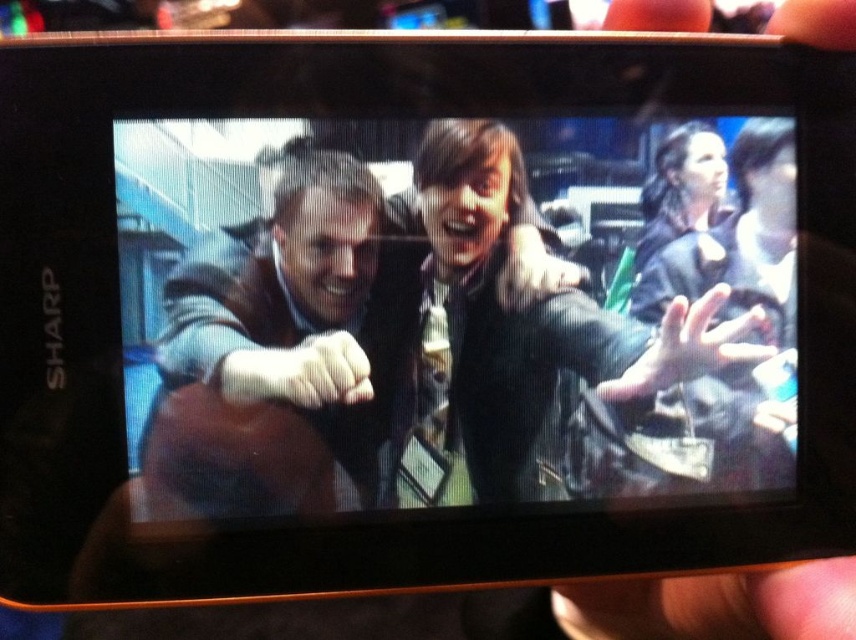
You are a film editor reviewing this scene. You need to zoom in on the smooth leather hand at center right marked by point [688,348]. Is this point located to the left or right of the center of the television screen?

The point [688,348] marks the smooth leather hand at center right, which is to the right of the center of the television screen.